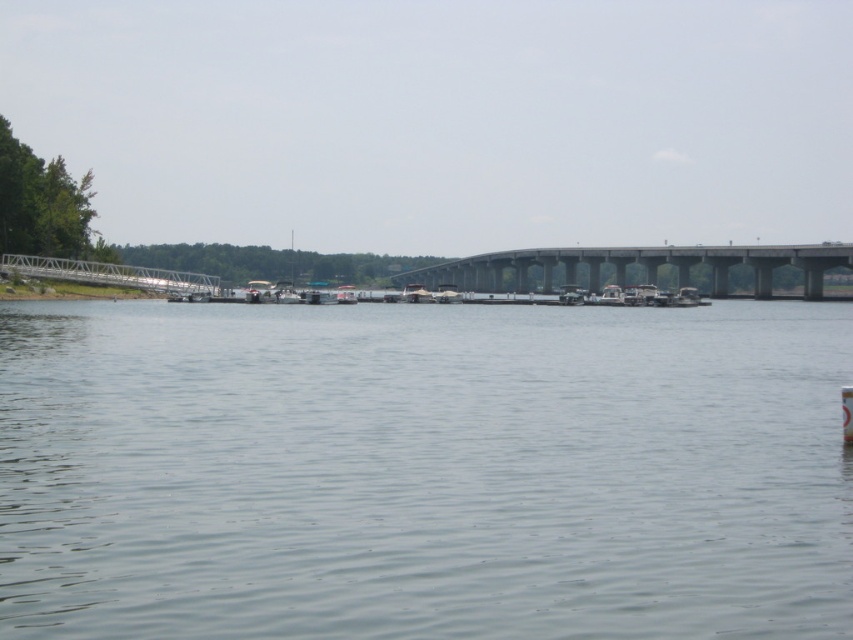
Who is more distant from viewer, (502, 342) or (769, 291)?

The point (769, 291) is more distant.

Image resolution: width=853 pixels, height=640 pixels. What do you see at coordinates (422, 470) in the screenshot? I see `gray smooth water at center` at bounding box center [422, 470].

Find the location of a particular element. The image size is (853, 640). gray smooth water at center is located at coordinates (422, 470).